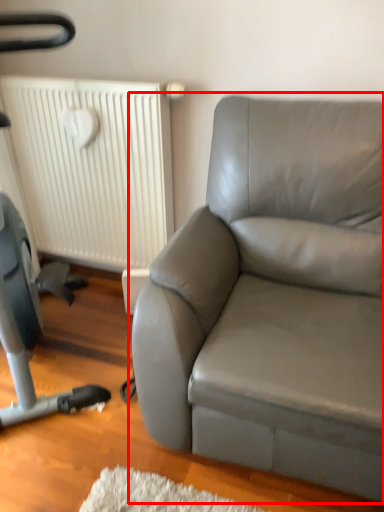
Question: Where is studio couch (annotated by the red box) located in relation to radiator in the image?

Choices:
 (A) left
 (B) right

Answer: (B)